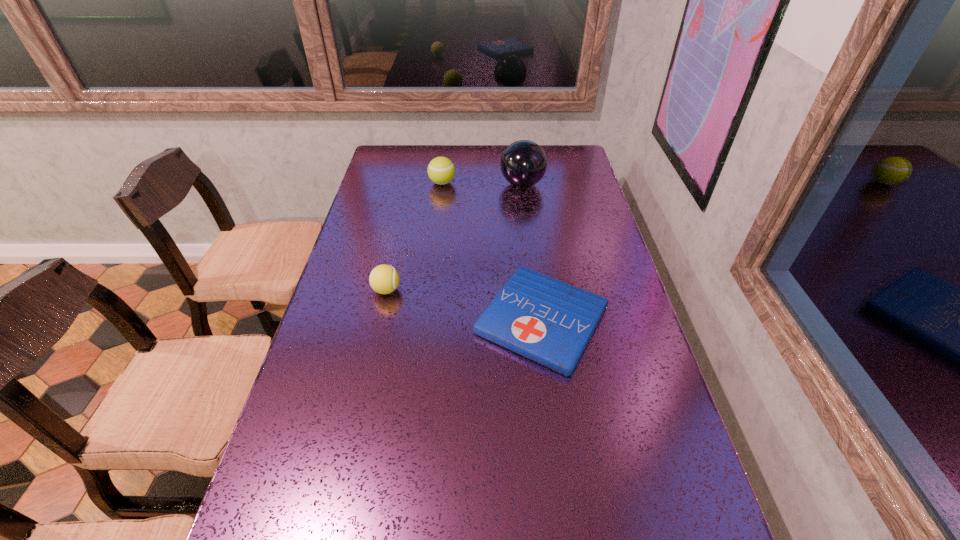
Identify the location of empty space between the shortest object and the tallest object. (532, 252).

Identify the location of vacant point located between the leftmost object and the farther tennis ball. This screenshot has height=540, width=960. (415, 237).

The image size is (960, 540). In order to click on vacant region between the third shortest object and the bowling ball in this screenshot , I will do `click(482, 184)`.

Where is `empty location between the third shortest object and the leftmost object`? This screenshot has height=540, width=960. empty location between the third shortest object and the leftmost object is located at coordinates (415, 237).

This screenshot has height=540, width=960. I want to click on free space between the right tennis ball and the shorter tennis ball, so click(x=415, y=237).

Where is `free space between the tallest object and the first-aid kit`? The image size is (960, 540). free space between the tallest object and the first-aid kit is located at coordinates (532, 252).

You are a GUI agent. You are given a task and a screenshot of the screen. Output one action in this format:
    pyautogui.click(x=<x>, y=<y>)
    Task: Click on the free spot between the leftmost object and the second object from left to right
    The width and height of the screenshot is (960, 540).
    Given the screenshot: What is the action you would take?
    pyautogui.click(x=415, y=237)

Locate an element on the screen. Image resolution: width=960 pixels, height=540 pixels. empty location between the first-aid kit and the left tennis ball is located at coordinates (464, 305).

Identify which object is located as the third nearest to the shortest object. Please provide its 2D coordinates. Your answer should be formatted as a tuple, i.e. [(x, y)], where the tuple contains the x and y coordinates of a point satisfying the conditions above.

[(441, 170)]

Identify which object is the third nearest to the bowling ball. Please provide its 2D coordinates. Your answer should be formatted as a tuple, i.e. [(x, y)], where the tuple contains the x and y coordinates of a point satisfying the conditions above.

[(384, 279)]